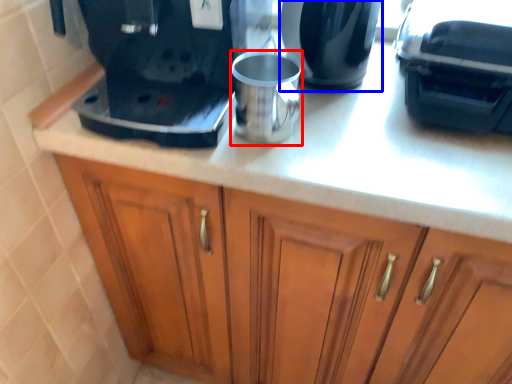
Question: Among these objects, which one is farthest to the camera, mug (highlighted by a red box) or kitchen appliance (highlighted by a blue box)?

Choices:
 (A) mug
 (B) kitchen appliance

Answer: (B)